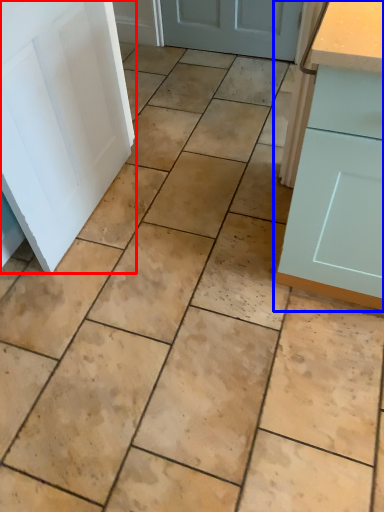
Question: Which point is closer to the camera, door (highlighted by a red box) or cabinetry (highlighted by a blue box)?

Choices:
 (A) door
 (B) cabinetry

Answer: (B)